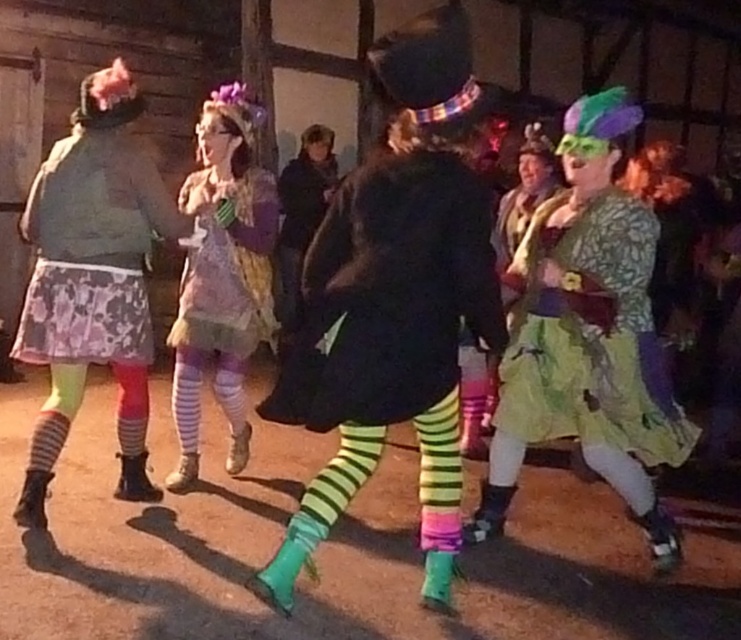
Does matte purple dress at center have a greater height compared to pastel floral dress at center?

Correct, matte purple dress at center is much taller as pastel floral dress at center.

Who is more forward, (213, 182) or (206, 250)?

Point (206, 250) is in front.

Between point (190, 305) and point (270, 280), which one is positioned in front?

Point (190, 305) is in front.

Image resolution: width=741 pixels, height=640 pixels. Identify the location of matte purple dress at center. (222, 276).

The image size is (741, 640). I want to click on green floral dress at center, so click(x=588, y=336).

Does green floral dress at center have a lesser width compared to pastel floral dress at center?

In fact, green floral dress at center might be wider than pastel floral dress at center.

The image size is (741, 640). What do you see at coordinates (588, 336) in the screenshot? I see `green floral dress at center` at bounding box center [588, 336].

At what (x,y) coordinates should I click in order to perform the action: click on green floral dress at center. Please return your answer as a coordinate pair (x, y). Image resolution: width=741 pixels, height=640 pixels. Looking at the image, I should click on (588, 336).

Which is behind, point (359, 378) or point (250, 205)?

The point (250, 205) is behind.

Does matte black coat at center appear on the left side of matte purple dress at center?

Incorrect, matte black coat at center is not on the left side of matte purple dress at center.

Locate an element on the screen. The width and height of the screenshot is (741, 640). matte black coat at center is located at coordinates (393, 304).